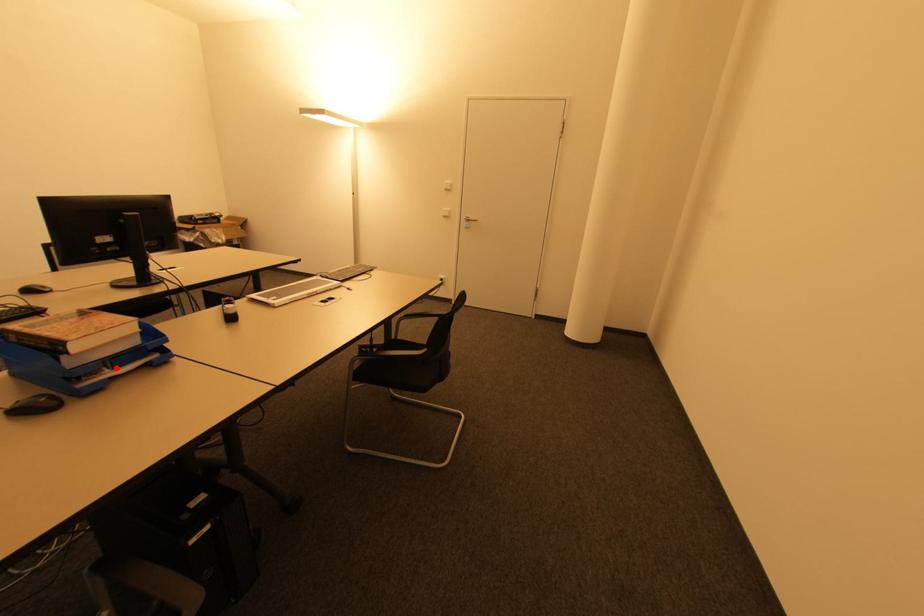
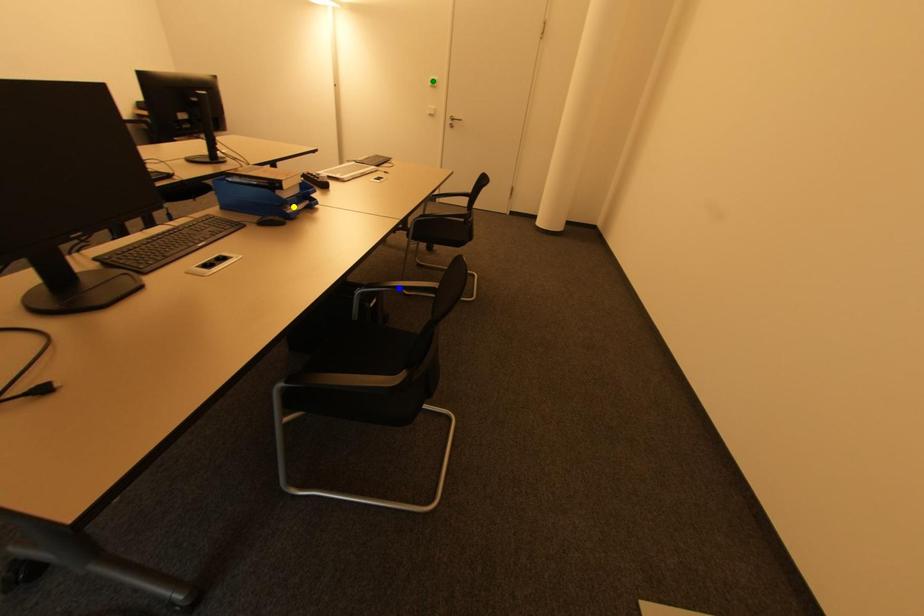
Question: I am providing you with two images of the same scene from different viewpoints. A red point is marked on the first image. You are given multiple points on the second image. In image 2, which mark is for the same physical point as the one in image 1?

Choices:
 (A) blue point
 (B) green point
 (C) yellow point

Answer: (C)